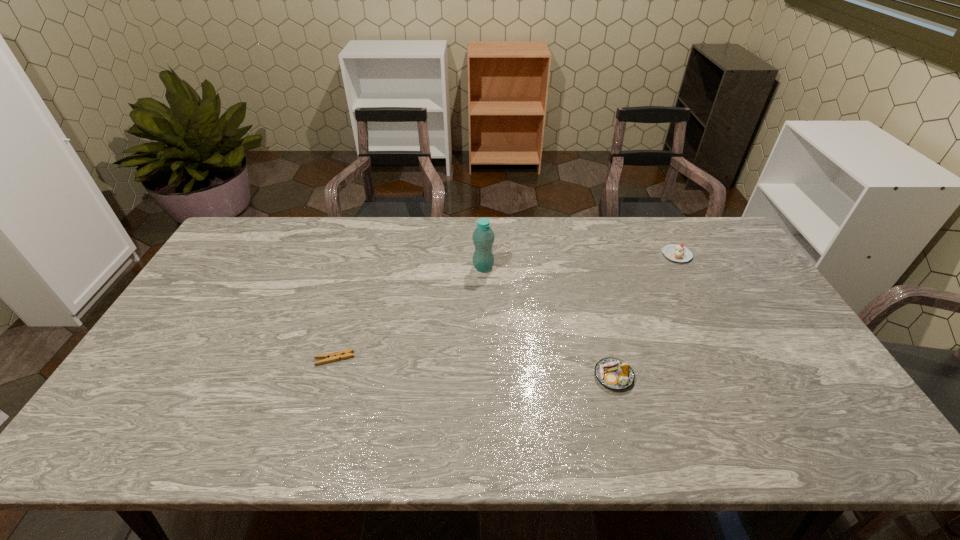
Identify the location of vacant space that satisfies the following two spatial constraints: 1. at the front cap of the third object from left to right; 2. on the left side of the tallest object. (484, 376).

You are a GUI agent. You are given a task and a screenshot of the screen. Output one action in this format:
    pyautogui.click(x=<x>, y=<y>)
    Task: Click on the free space in the image that satisfies the following two spatial constraints: 1. at the front cap of the second object from right to left; 2. on the left side of the water bottle
    
    Given the screenshot: What is the action you would take?
    pyautogui.click(x=484, y=376)

Identify the location of free point that satisfies the following two spatial constraints: 1. at the front cap of the third object from right to left; 2. on the right side of the pastry. This screenshot has height=540, width=960. (484, 376).

Locate an element on the screen. Image resolution: width=960 pixels, height=540 pixels. free space that satisfies the following two spatial constraints: 1. on the back side of the shortest object; 2. on the left side of the cupcake is located at coordinates (366, 255).

Identify the location of free space in the image that satisfies the following two spatial constraints: 1. at the front cap of the third object from right to left; 2. on the left side of the second object from right to left. (484, 376).

The width and height of the screenshot is (960, 540). I want to click on vacant space that satisfies the following two spatial constraints: 1. at the front cap of the pastry; 2. on the right side of the water bottle, so click(x=484, y=376).

The height and width of the screenshot is (540, 960). Find the location of `vacant space that satisfies the following two spatial constraints: 1. at the front cap of the tallest object; 2. on the right side of the second object from right to left`. vacant space that satisfies the following two spatial constraints: 1. at the front cap of the tallest object; 2. on the right side of the second object from right to left is located at coordinates (484, 376).